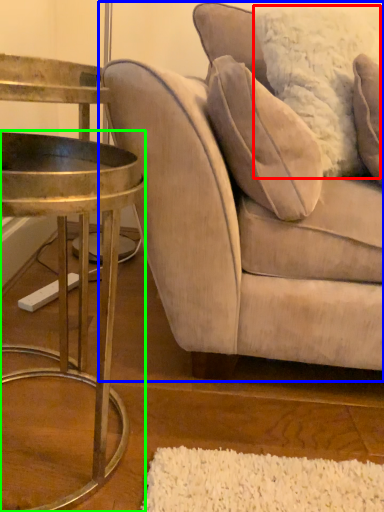
Question: Estimate the real-world distances between objects in this image. Which object is closer to pillow (highlighted by a red box), studio couch (highlighted by a blue box) or table (highlighted by a green box)?

Choices:
 (A) studio couch
 (B) table

Answer: (A)